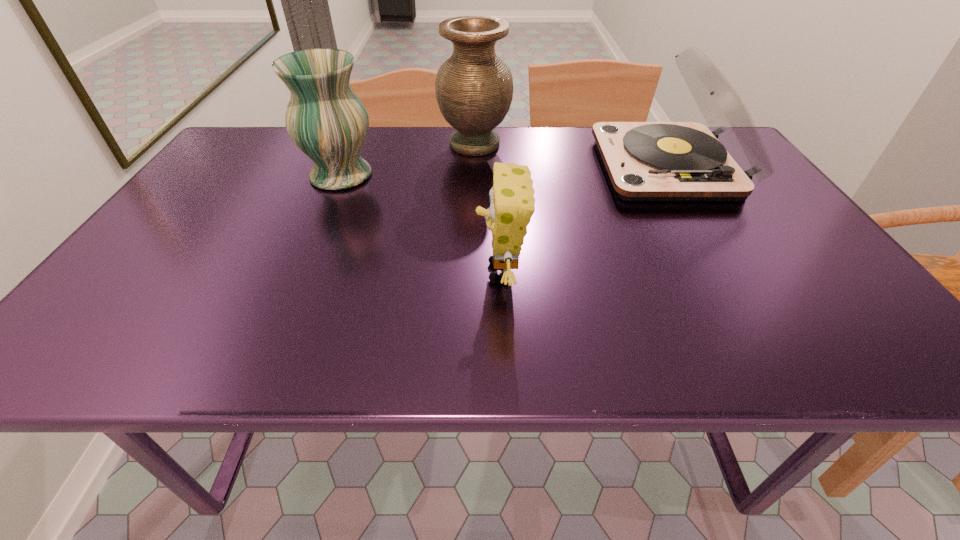
In the image, there is a desktop. Where is `vacant space at the right edge`? Image resolution: width=960 pixels, height=540 pixels. vacant space at the right edge is located at coordinates (756, 220).

What are the coordinates of `vacant region at the far left corner of the desktop` in the screenshot? It's located at (270, 133).

Find the location of `blank area at the near right corner`. blank area at the near right corner is located at coordinates (889, 340).

Locate an element on the screen. The height and width of the screenshot is (540, 960). vacant area that lies between the nearest object and the leftmost object is located at coordinates (420, 224).

The image size is (960, 540). Identify the location of vacant region between the rightmost object and the right vase. (571, 156).

Image resolution: width=960 pixels, height=540 pixels. In order to click on free space between the nearest object and the rightmost object in this screenshot , I will do `click(584, 219)`.

At what (x,y) coordinates should I click in order to perform the action: click on vacant space that is in between the sponge and the right vase. Please return your answer as a coordinate pair (x, y). Looking at the image, I should click on (488, 208).

The image size is (960, 540). In order to click on free point between the rightmost object and the nearest object in this screenshot , I will do `click(584, 219)`.

I want to click on empty location between the right vase and the record player, so click(x=571, y=156).

Find the location of a particular element. The image size is (960, 540). empty space between the sponge and the right vase is located at coordinates (488, 208).